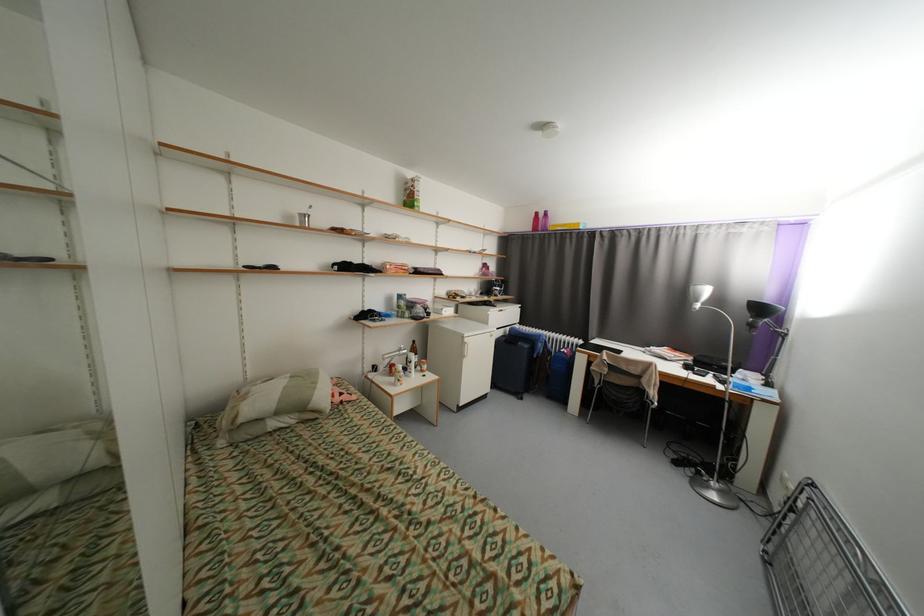
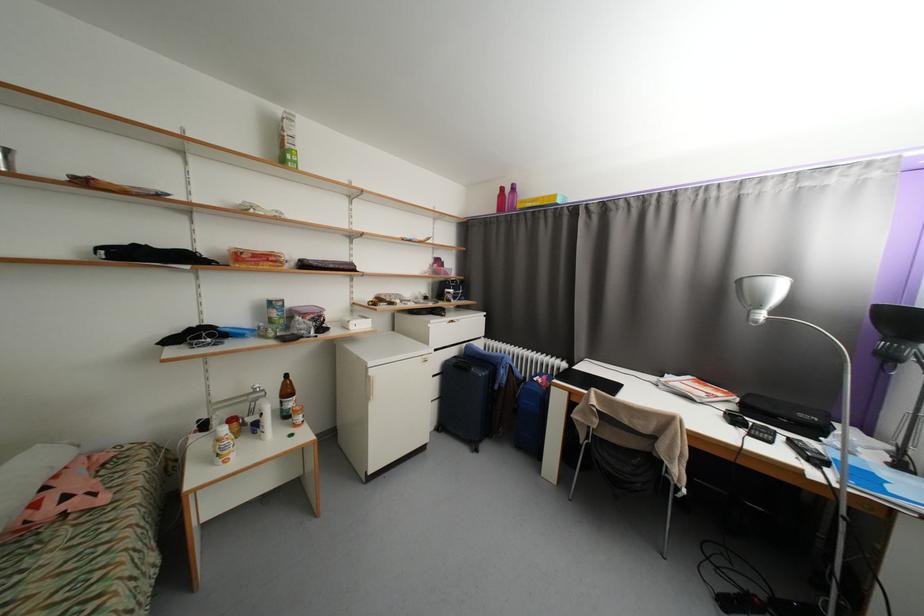
In the second image, find the point that corresponds to (469,345) in the first image.

(373, 379)